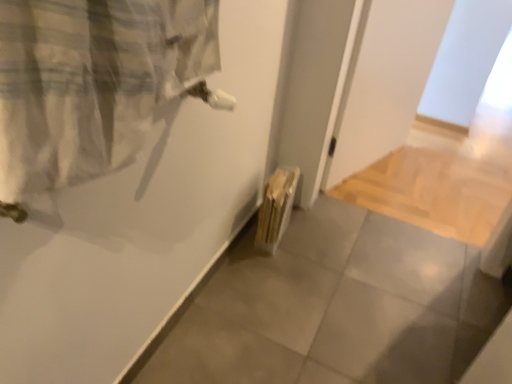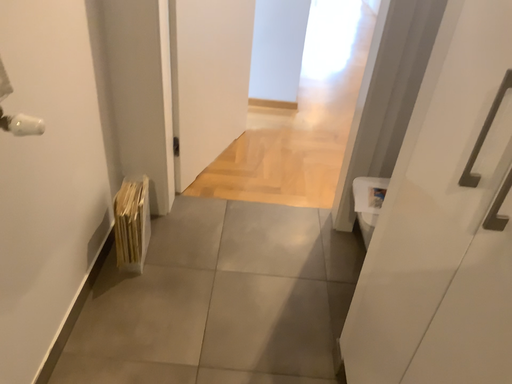
Question: Which way did the camera rotate in the video?

Choices:
 (A) rotated right
 (B) rotated left

Answer: (A)